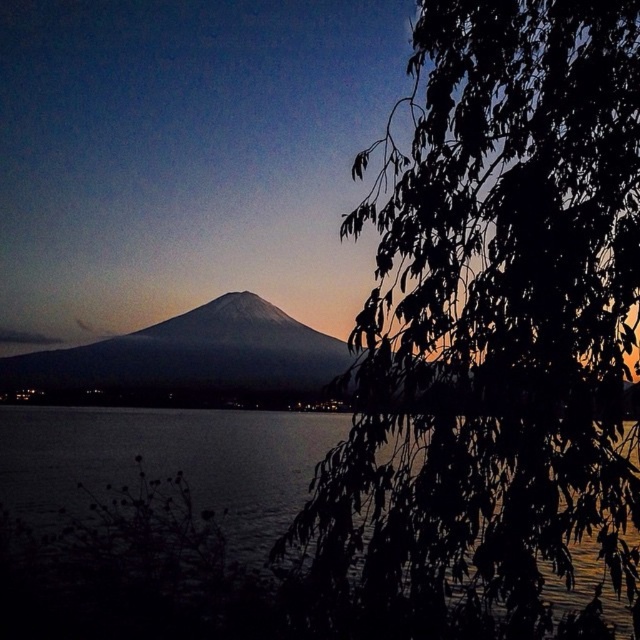
You are standing in the foreground of the scene and want to take a photo of Mount Fuji. The green leafy branch at right is blocking your view. Where should you move to avoid it?

You should move to the left side of the scene to avoid the green leafy branch at right, which is located at point (x=493, y=324) in the frame.

You are an artist planning to sketch this scene. You want to ensure the green leafy branch at right and the gray matte mountain at center are proportionally accurate. Which object should you draw first to maintain scale, and why?

You should draw the gray matte mountain at center first because it is larger than the green leafy branch at right. Starting with the larger object helps establish the scale, making it easier to proportionally place the smaller branch afterward.

You are an artist trying to sketch this scene. You notice the green leafy branch at right and the dark water at lower left. Which object should you draw first if you want to follow the principle of drawing foreground elements before background elements?

The green leafy branch at right should be drawn first because it is in the foreground, closer to the viewer compared to the dark water at lower left which is part of the middle ground or background.